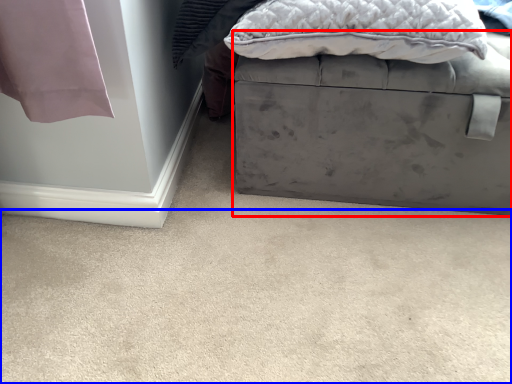
Question: Among these objects, which one is farthest to the camera, furniture (highlighted by a red box) or concrete (highlighted by a blue box)?

Choices:
 (A) furniture
 (B) concrete

Answer: (A)